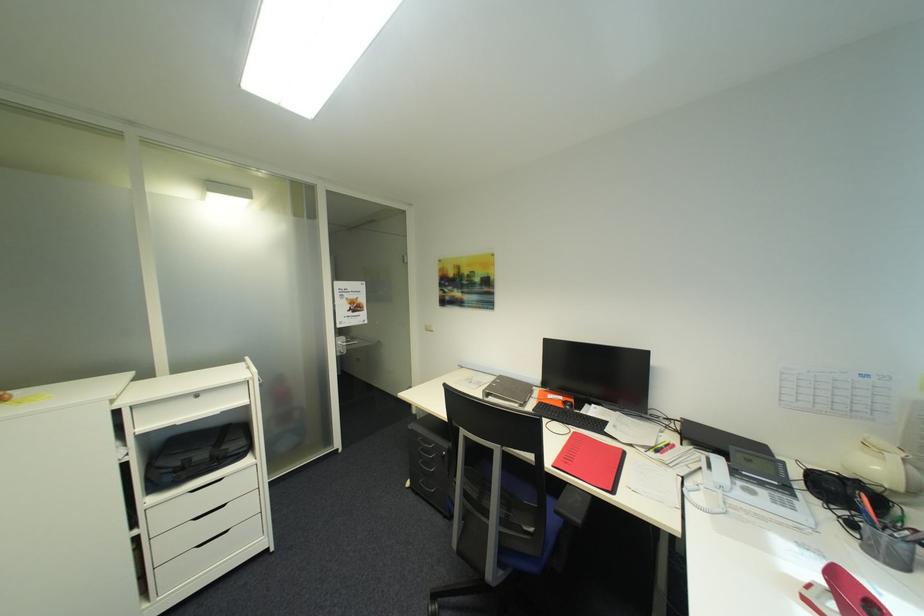
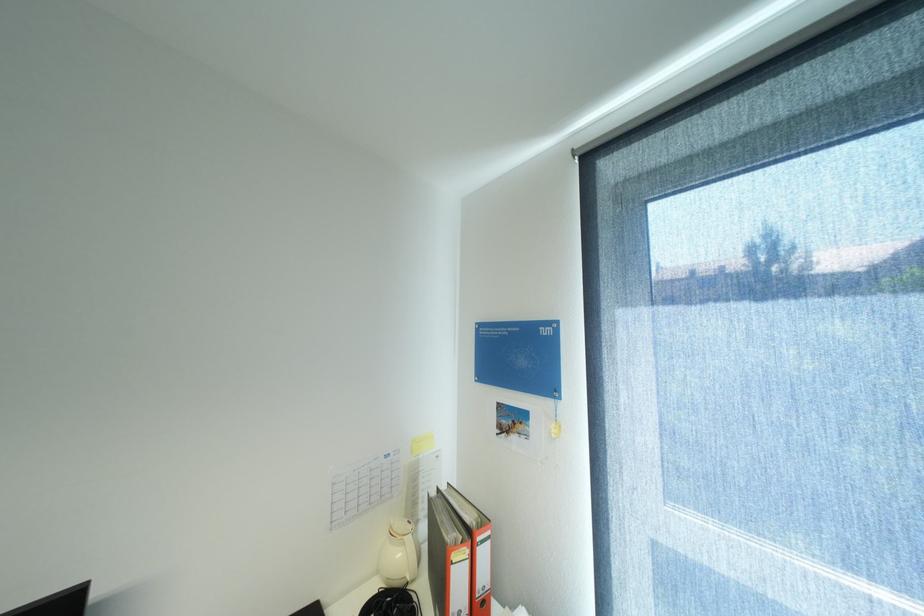
In the second image, find the point that corresponds to [886,469] in the first image.

(407, 554)